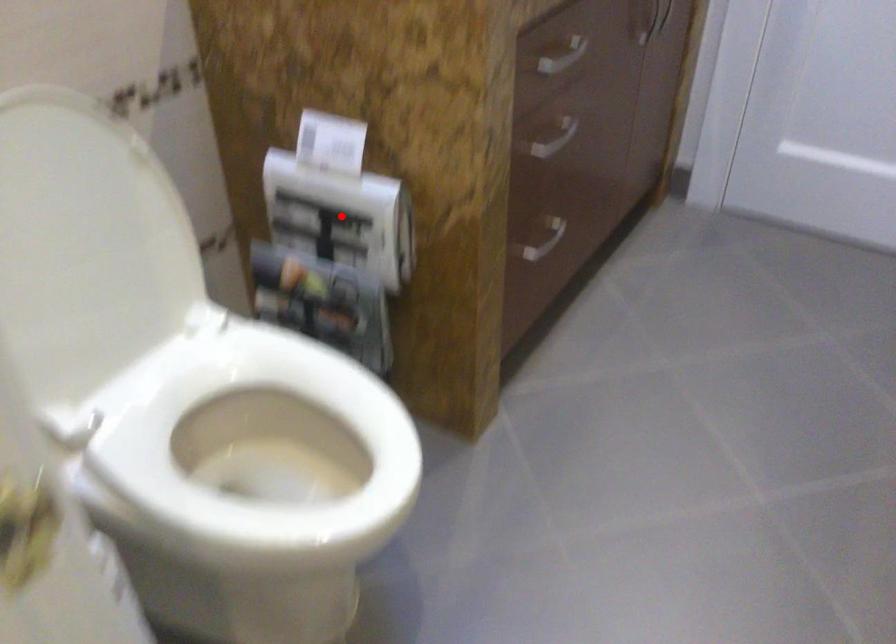
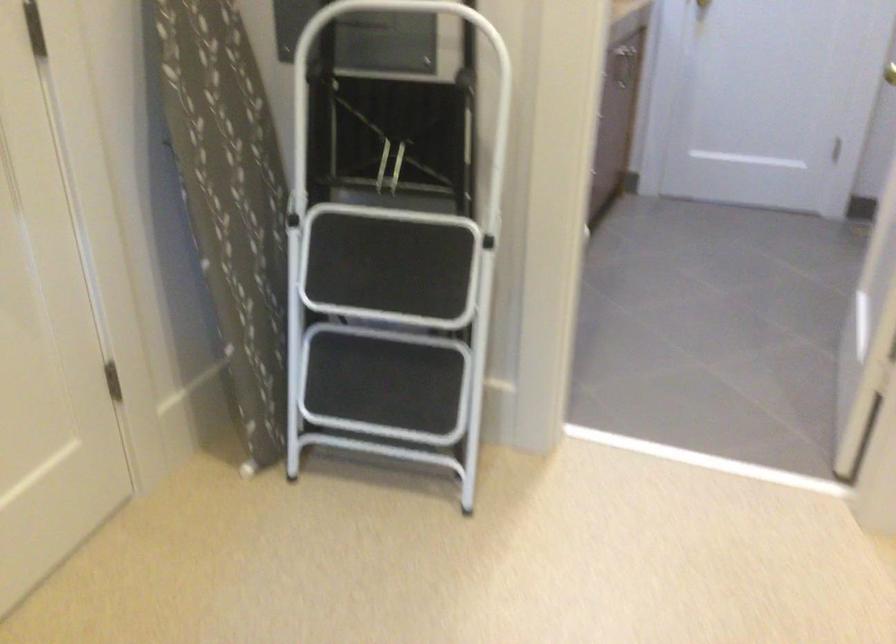
Question: I am providing you with two images of the same scene from different viewpoints. A red point is marked on the first image. At the location where the point appears in image 1, is it still visible in image 2?

Choices:
 (A) Yes
 (B) No

Answer: (B)